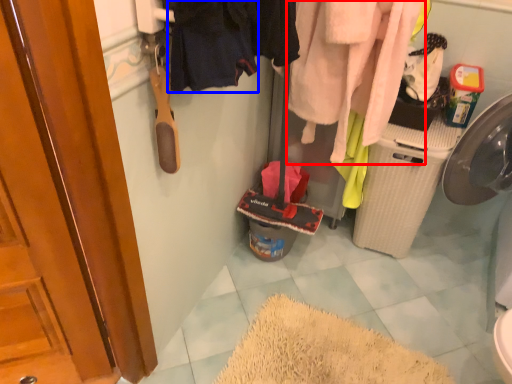
Question: Among these objects, which one is farthest to the camera, clothing (highlighted by a red box) or clothing (highlighted by a blue box)?

Choices:
 (A) clothing
 (B) clothing

Answer: (A)